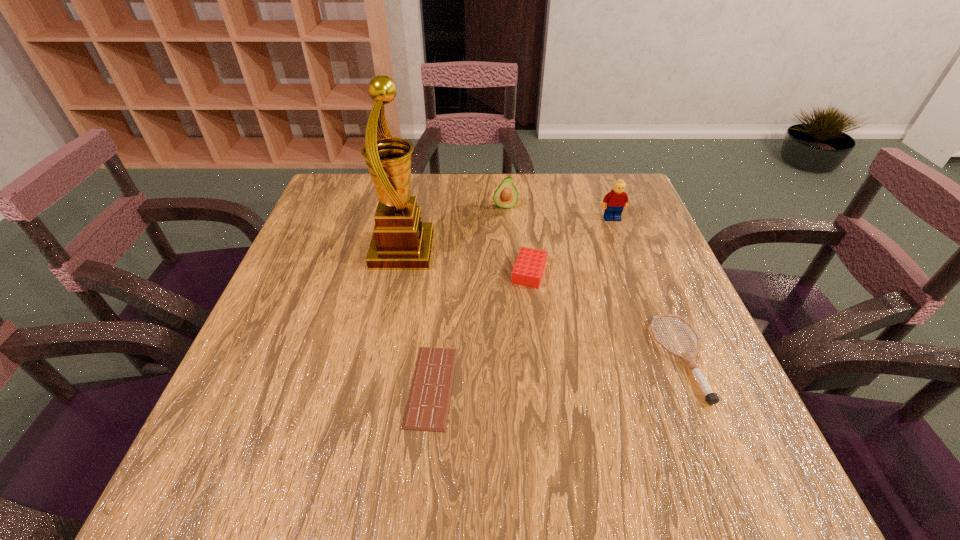
The height and width of the screenshot is (540, 960). What are the coordinates of `free space that satisfies the following two spatial constraints: 1. on the cut side of the avocado; 2. on the right side of the second shortest object` in the screenshot? It's located at (516, 358).

You are a GUI agent. You are given a task and a screenshot of the screen. Output one action in this format:
    pyautogui.click(x=<x>, y=<y>)
    Task: Click on the free point that satisfies the following two spatial constraints: 1. on the cut side of the avocado; 2. on the front-facing side of the award
    This screenshot has width=960, height=540.
    Given the screenshot: What is the action you would take?
    pyautogui.click(x=508, y=251)

I want to click on free space that satisfies the following two spatial constraints: 1. on the cut side of the second shortest object; 2. on the right side of the farthest object, so click(x=516, y=358).